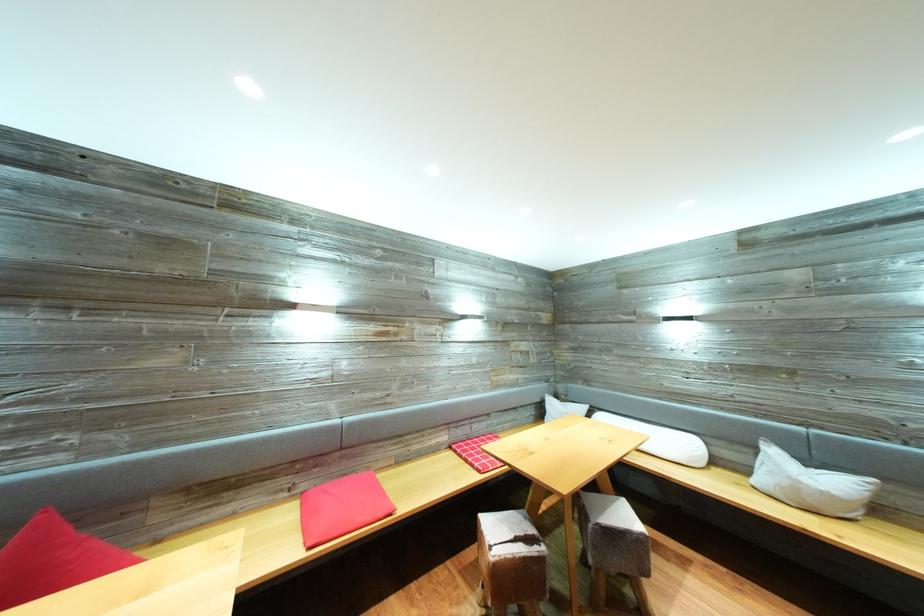
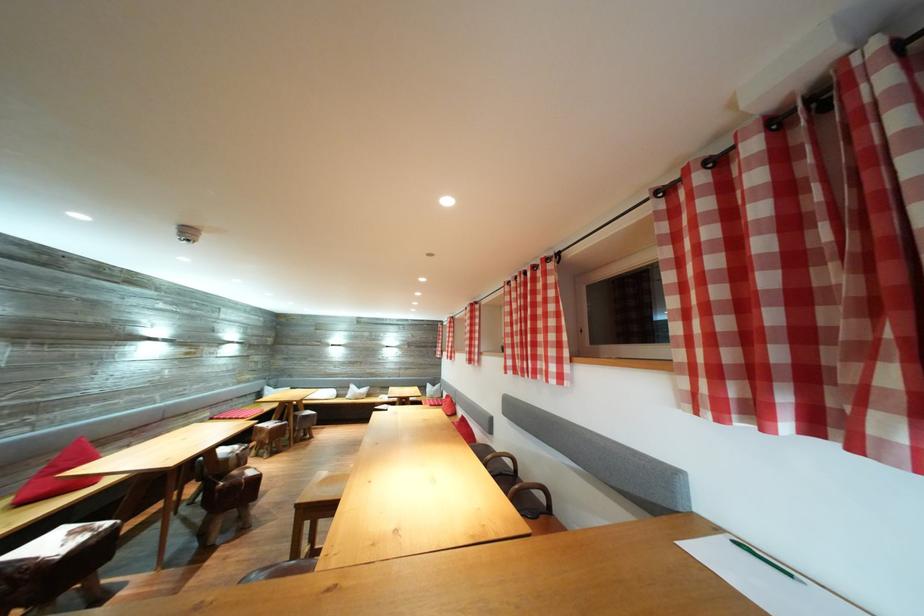
In the second image, find the point that corresponds to the point at 781,458 in the first image.

(359, 392)